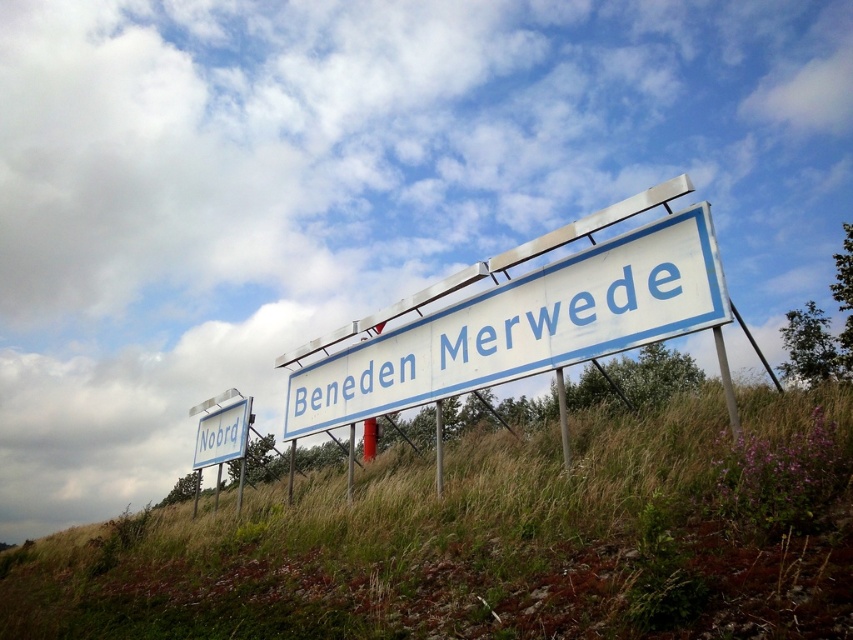
Between green grassy at lower center and white plastic sign at center, which one is positioned lower?

green grassy at lower center is below.

Can you confirm if green grassy at lower center is thinner than white plastic sign at center?

Incorrect, green grassy at lower center's width is not less than white plastic sign at center's.

Is point (631, 492) behind point (335, 385)?

No.

The height and width of the screenshot is (640, 853). Identify the location of green grassy at lower center. coord(492,541).

Can you confirm if green grassy at lower center is bigger than white plastic sign at lower left?

Correct, green grassy at lower center is larger in size than white plastic sign at lower left.

Which is behind, point (593, 429) or point (219, 428)?

Point (219, 428)

Is point (0, 609) positioned after point (247, 412)?

No, it is in front of (247, 412).

Where is `green grassy at lower center`? green grassy at lower center is located at coordinates (492, 541).

What do you see at coordinates (525, 324) in the screenshot? The height and width of the screenshot is (640, 853). I see `white plastic sign at center` at bounding box center [525, 324].

Who is shorter, white plastic sign at center or white plastic sign at lower left?

white plastic sign at center is shorter.

Is point (426, 324) closer to viewer compared to point (199, 410)?

Yes, point (426, 324) is in front of point (199, 410).

Where is `white plastic sign at center`? The height and width of the screenshot is (640, 853). white plastic sign at center is located at coordinates (525, 324).